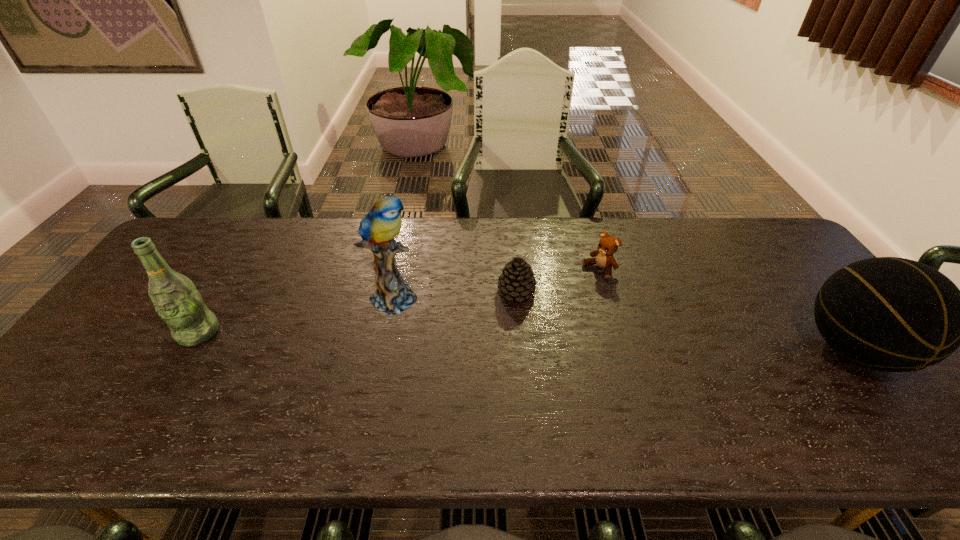
You are a GUI agent. You are given a task and a screenshot of the screen. Output one action in this format:
    pyautogui.click(x=<x>, y=<y>)
    Task: Click on the free space located on the face of the tallest object
    
    Given the screenshot: What is the action you would take?
    pyautogui.click(x=436, y=320)

At what (x,y) coordinates should I click in order to perform the action: click on vacant position located 0.100m on the front-facing side of the second object from right to left. Please return your answer as a coordinate pair (x, y). Looking at the image, I should click on (568, 293).

Locate an element on the screen. This screenshot has width=960, height=540. free region located 0.140m on the front-facing side of the second object from right to left is located at coordinates (559, 300).

This screenshot has height=540, width=960. Find the location of `blank space located on the front-facing side of the second object from right to left`. blank space located on the front-facing side of the second object from right to left is located at coordinates click(x=503, y=340).

At what (x,y) coordinates should I click in order to perform the action: click on blank area located 0.210m at the narrow end of the third object from left to right. Please return your answer as a coordinate pair (x, y). Image resolution: width=960 pixels, height=540 pixels. Looking at the image, I should click on (471, 355).

Where is `blank space located 0.060m at the narrow end of the third object from left to right`? The image size is (960, 540). blank space located 0.060m at the narrow end of the third object from left to right is located at coordinates (498, 317).

Where is `vacant region located 0.200m at the narrow end of the third object from left to right`? The width and height of the screenshot is (960, 540). vacant region located 0.200m at the narrow end of the third object from left to right is located at coordinates (473, 353).

Identify the location of object that is at the far edge. (608, 245).

Where is `object located at the near edge`? object located at the near edge is located at coordinates (890, 314).

Locate an element on the screen. Image resolution: width=960 pixels, height=540 pixels. object that is at the right edge is located at coordinates (890, 314).